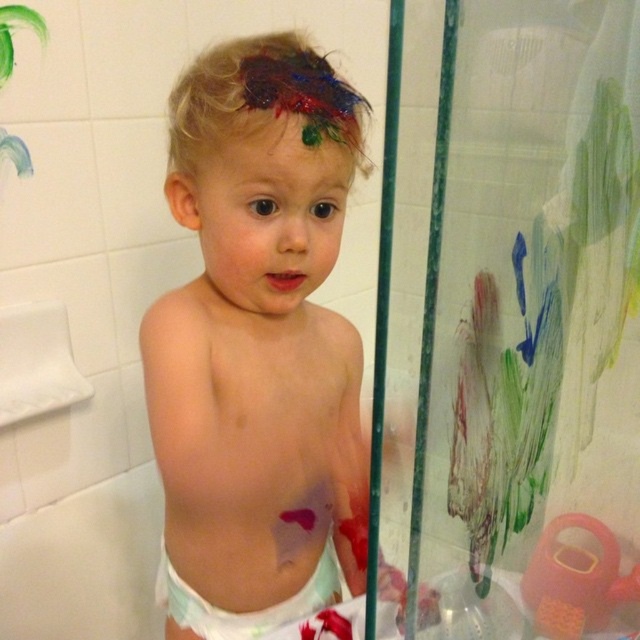
Question: Does transparent plastic screen door at upper right have a greater width compared to multicolored paint at center?

Choices:
 (A) no
 (B) yes

Answer: (B)

Question: Which object appears closest to the camera in this image?

Choices:
 (A) transparent plastic screen door at upper right
 (B) white cloth diaper at lower center
 (C) dirty diaper at center

Answer: (A)

Question: Which point is farther to the camera?

Choices:
 (A) multicolored paint at center
 (B) transparent plastic screen door at upper right

Answer: (A)

Question: Can you confirm if transparent plastic screen door at upper right is thinner than white cloth diaper at lower center?

Choices:
 (A) no
 (B) yes

Answer: (A)

Question: Is the position of dirty diaper at center less distant than that of white cloth diaper at lower center?

Choices:
 (A) yes
 (B) no

Answer: (A)

Question: Which point is farther to the camera?

Choices:
 (A) dirty diaper at center
 (B) transparent plastic screen door at upper right
 (C) multicolored paint at center
 (D) white cloth diaper at lower center

Answer: (D)